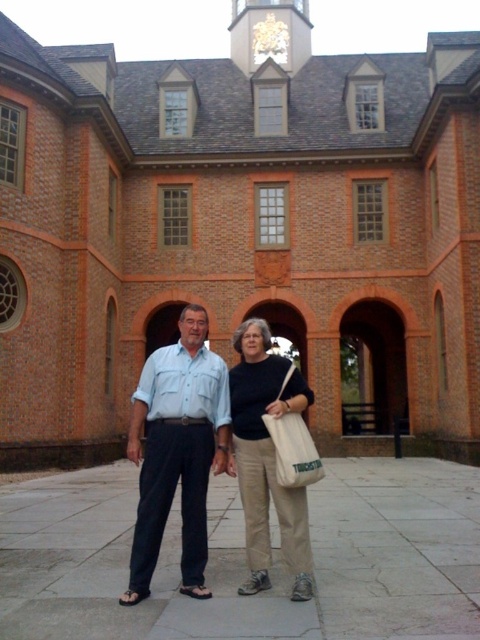
Between beige cotton pants at center and white canvas bag at center, which one appears on the left side from the viewer's perspective?

beige cotton pants at center is more to the left.

Is beige cotton pants at center behind white canvas bag at center?

No, it is in front of white canvas bag at center.

The image size is (480, 640). What do you see at coordinates (266, 458) in the screenshot?
I see `beige cotton pants at center` at bounding box center [266, 458].

Identify the location of beige cotton pants at center. (266, 458).

Is light blue denim shirt at center thinner than beige cotton pants at center?

Incorrect, light blue denim shirt at center's width is not less than beige cotton pants at center's.

Who is higher up, light blue denim shirt at center or beige cotton pants at center?

beige cotton pants at center is higher up.

Who is more distant from viewer, (163, 438) or (237, 440)?

The point (237, 440) is behind.

Find the location of `light blue denim shirt at center`. light blue denim shirt at center is located at coordinates (177, 451).

Between light blue denim shirt at center and white canvas bag at center, which one is positioned lower?

Answer: white canvas bag at center is below.

I want to click on light blue denim shirt at center, so click(x=177, y=451).

Identify the location of light blue denim shirt at center. This screenshot has width=480, height=640. (177, 451).